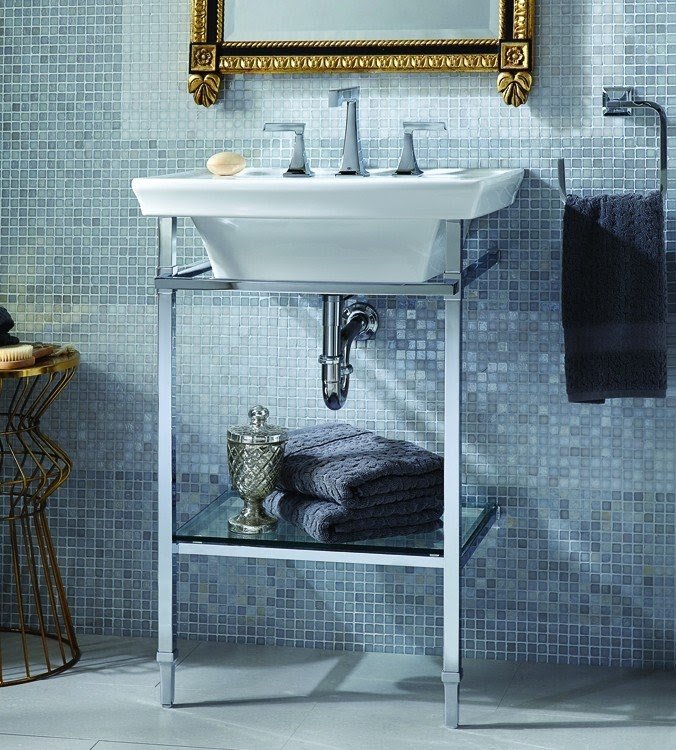
Find the location of a particular element. floor is located at coordinates (361, 712).